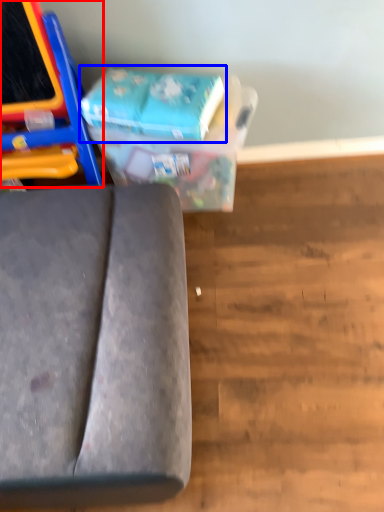
Question: Which point is further to the camera, furniture (highlighted by a red box) or paperback book (highlighted by a blue box)?

Choices:
 (A) furniture
 (B) paperback book

Answer: (B)